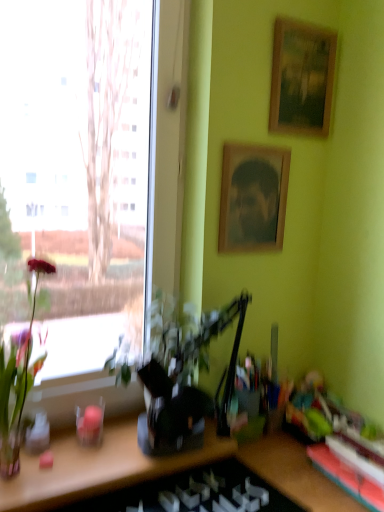
Question: Would you say green glossy plant at left, the second houseplant positioned from the right, is inside or outside transparent glass window at left?

Choices:
 (A) outside
 (B) inside

Answer: (B)

Question: Is green glossy plant at left, the second houseplant positioned from the right, wider or thinner than transparent glass window at left?

Choices:
 (A) thin
 (B) wide

Answer: (B)

Question: Which of these objects is positioned farthest from the rubberized green toy at lower right?

Choices:
 (A) wooden bookshelf at lower right
 (B) wooden picture frame at upper center, positioned as the second picture frame in top-to-bottom order
 (C) green leafy plant at left, which is the 1th houseplant in right-to-left order
 (D) wooden framed picture at upper right, which ranks as the 1th picture frame in top-to-bottom order
 (E) transparent glass window at left

Answer: (E)

Question: Based on their relative distances, which object is nearer to the wooden framed picture at upper right, the second picture frame ordered from the bottom?

Choices:
 (A) wooden picture frame at upper center, which ranks as the 1th picture frame in bottom-to-top order
 (B) green leafy plant at left, which is the 1th houseplant in right-to-left order
 (C) rubberized green toy at lower right
 (D) wooden bookshelf at lower right
 (E) transparent glass window at left

Answer: (A)